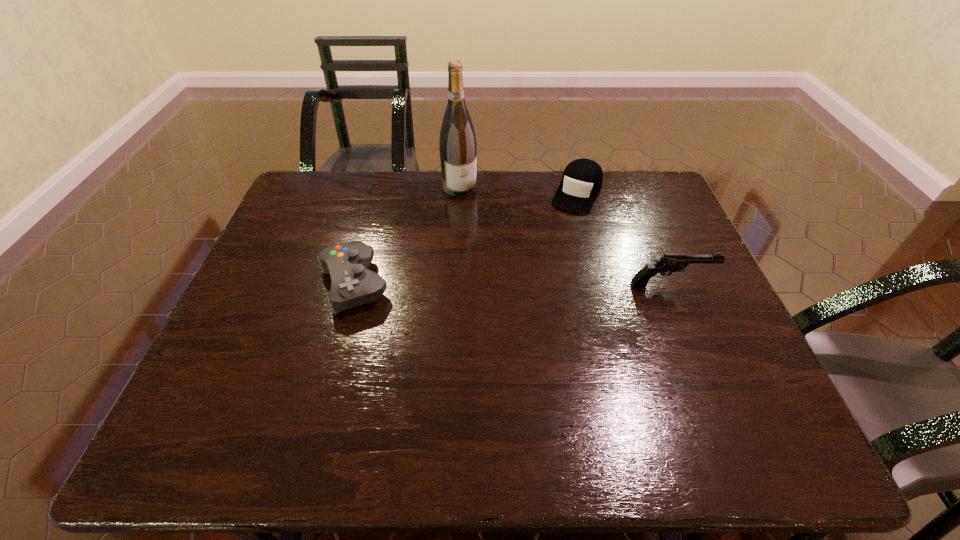
Locate an element on the screen. vacant space positioned 0.100m on the front-facing side of the cap is located at coordinates (560, 233).

This screenshot has width=960, height=540. Find the location of `free location located 0.180m on the front-facing side of the cap`. free location located 0.180m on the front-facing side of the cap is located at coordinates (550, 250).

Locate an element on the screen. Image resolution: width=960 pixels, height=540 pixels. wine bottle that is at the far edge is located at coordinates click(458, 148).

The width and height of the screenshot is (960, 540). Find the location of `cap that is at the far edge`. cap that is at the far edge is located at coordinates (582, 179).

Image resolution: width=960 pixels, height=540 pixels. In order to click on object that is at the right edge in this screenshot , I will do `click(668, 263)`.

At what (x,y) coordinates should I click in order to perform the action: click on vacant space at the far edge of the desktop. Please return your answer as a coordinate pair (x, y). This screenshot has height=540, width=960. Looking at the image, I should click on (491, 188).

This screenshot has height=540, width=960. In the image, there is a desktop. In order to click on free space at the near edge in this screenshot , I will do `click(447, 404)`.

Find the location of a particular element. This screenshot has width=960, height=540. free space at the left edge of the desktop is located at coordinates (254, 290).

In the image, there is a desktop. Identify the location of vacant space at the right edge. This screenshot has height=540, width=960. pos(685,318).

This screenshot has height=540, width=960. Identify the location of free location at the far left corner. point(311,175).